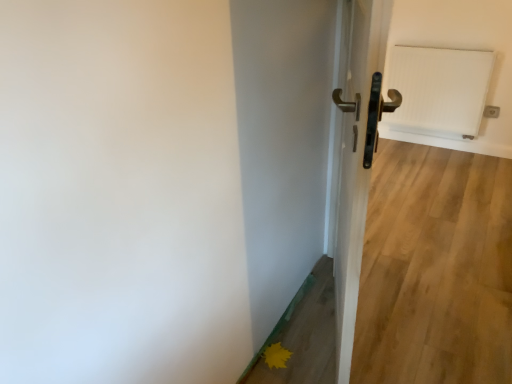
At what (x,y) coordinates should I click in order to perform the action: click on vacant area on the back side of yellow matte flower at lower right. Please return your answer as a coordinate pair (x, y). This screenshot has width=512, height=384. Looking at the image, I should click on [290, 328].